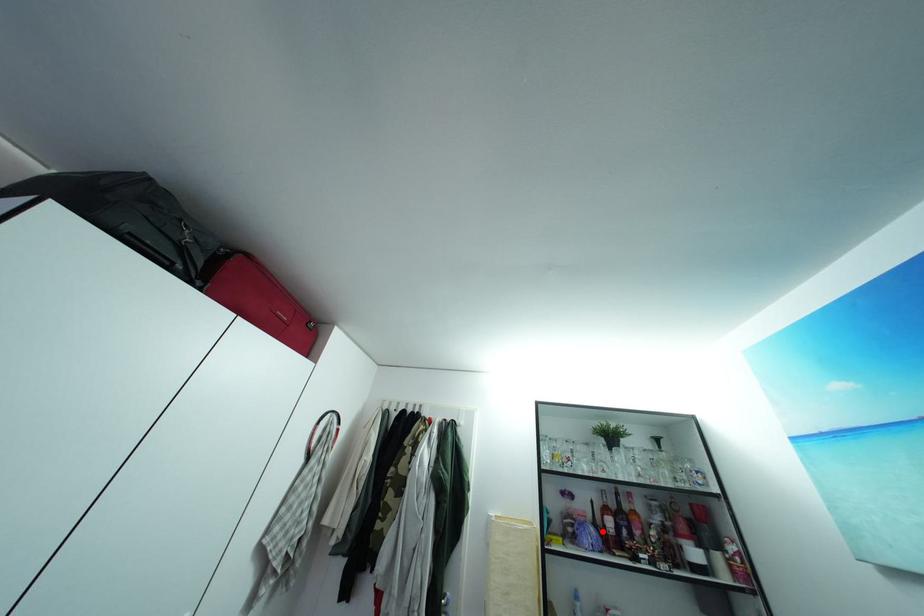
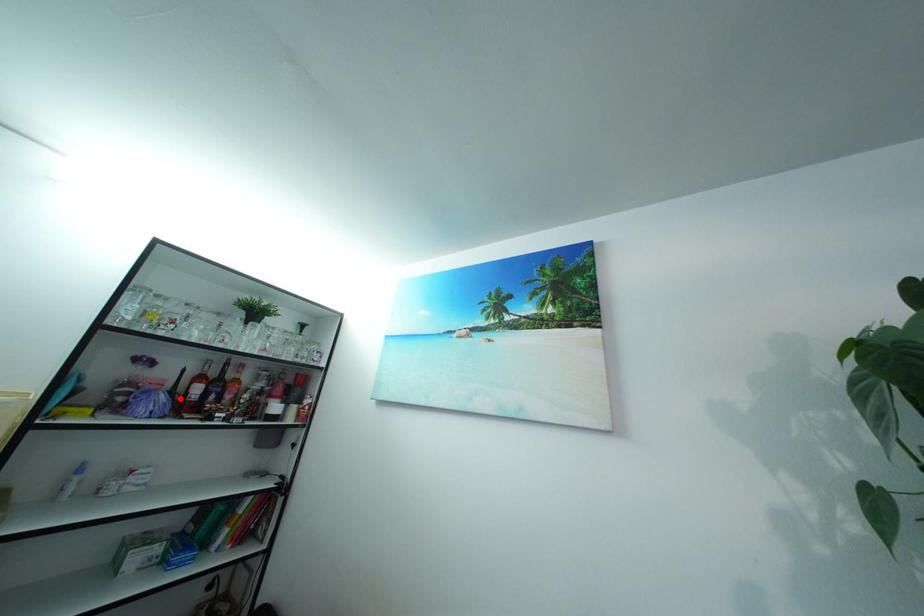
I am providing you with two images of the same scene from different viewpoints. A red point is marked on the first image and another point is marked on the second image. Are the points marked in image1 and image2 representing the same 3D position?

Yes